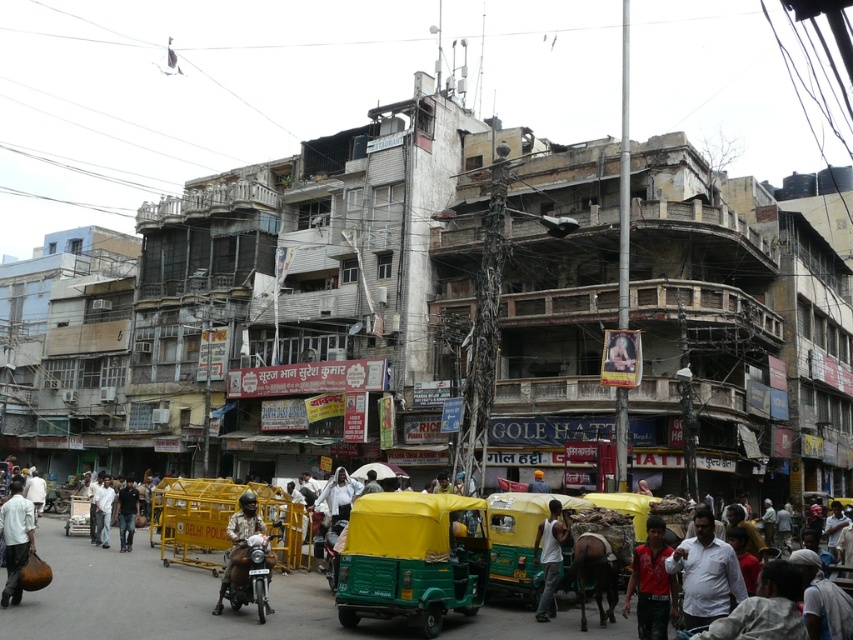
Does point (204, 480) come in front of point (74, 522)?

Yes, point (204, 480) is closer to viewer.

Which is more to the left, metallic barricade at center or wooden cart at center?

Positioned to the left is wooden cart at center.

In order to click on metallic barricade at center in this screenshot , I will do `click(218, 520)`.

I want to click on metallic barricade at center, so click(218, 520).

Can you confirm if red shirt at center is taller than white tank top at center?

Yes, red shirt at center is taller than white tank top at center.

Is point (646, 637) less distant than point (560, 552)?

Yes, point (646, 637) is closer to viewer.

You are a GUI agent. You are given a task and a screenshot of the screen. Output one action in this format:
    pyautogui.click(x=<x>, y=<y>)
    Task: Click on the red shirt at center
    
    Given the screenshot: What is the action you would take?
    pyautogui.click(x=651, y=582)

Which of these two, yellow fabric rickshaw at center or light brown fabric shirt at lower left, stands shorter?

Standing shorter between the two is yellow fabric rickshaw at center.

Looking at this image, does yellow fabric rickshaw at center appear under light brown fabric shirt at lower left?

Incorrect, yellow fabric rickshaw at center is not positioned below light brown fabric shirt at lower left.

Who is more distant from viewer, [409,499] or [22,515]?

The point [22,515] is more distant.

The image size is (853, 640). Identify the location of yellow fabric rickshaw at center. (412, 557).